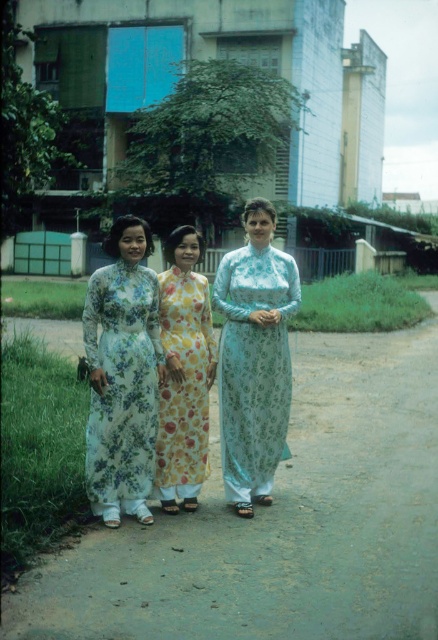
Question: Does light blue floral ao dai at center appear over yellow floral silk dress at center?

Choices:
 (A) yes
 (B) no

Answer: (A)

Question: Which is nearer to the light blue floral ao dai at center?

Choices:
 (A) smooth concrete path at center
 (B) floral silk ao dai at center
 (C) yellow floral silk dress at center

Answer: (C)

Question: From the image, what is the correct spatial relationship of smooth concrete path at center in relation to yellow floral silk dress at center?

Choices:
 (A) left
 (B) right

Answer: (A)

Question: Which of the following is the closest to the observer?

Choices:
 (A) (120, 490)
 (B) (172, 387)
 (C) (235, 452)
 (D) (293, 500)

Answer: (A)

Question: Among these objects, which one is farthest from the camera?

Choices:
 (A) yellow floral silk dress at center
 (B) floral silk ao dai at center

Answer: (A)

Question: Can you confirm if light blue floral ao dai at center is bigger than yellow floral silk dress at center?

Choices:
 (A) no
 (B) yes

Answer: (B)